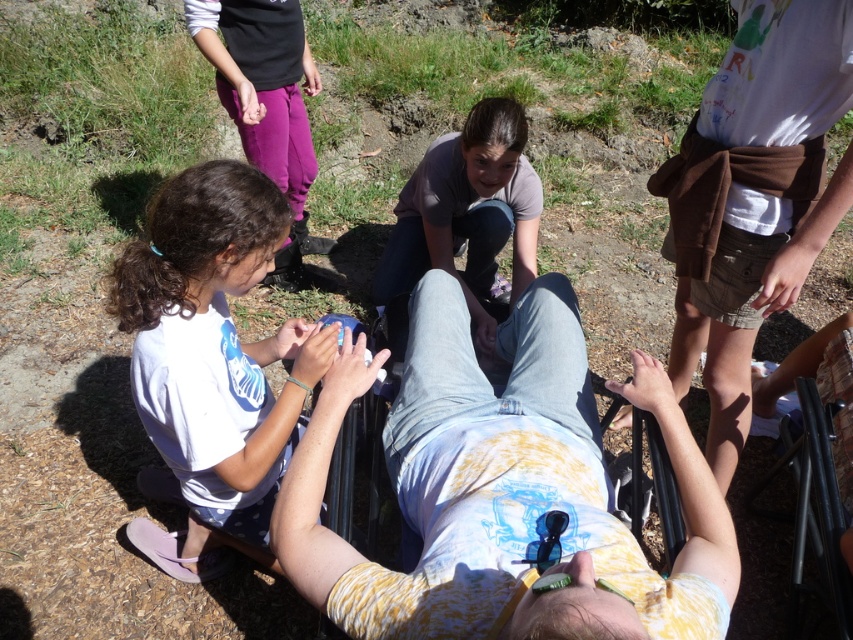
Who is positioned more to the right, denim jeans at center or matte gray shirt at center?

matte gray shirt at center

I want to click on denim jeans at center, so click(503, 490).

Who is more distant from viewer, (708, 484) or (502, 237)?

The point (502, 237) is more distant.

Find the location of a particular element. denim jeans at center is located at coordinates (503, 490).

Which is below, denim jeans at center or white matte shirt at center?

white matte shirt at center

Is point (508, 348) more distant than point (215, 435)?

That is True.

Is point (424, 314) farther from viewer compared to point (163, 445)?

Yes, point (424, 314) is behind point (163, 445).

This screenshot has width=853, height=640. What are the coordinates of `denim jeans at center` in the screenshot? It's located at (503, 490).

Who is positioned more to the left, white matte shirt at center or matte gray shirt at center?

From the viewer's perspective, white matte shirt at center appears more on the left side.

Can you confirm if white matte shirt at center is thinner than matte gray shirt at center?

Incorrect, white matte shirt at center's width is not less than matte gray shirt at center's.

Describe the element at coordinates (212, 364) in the screenshot. I see `white matte shirt at center` at that location.

Where is `white matte shirt at center`? This screenshot has width=853, height=640. white matte shirt at center is located at coordinates (212, 364).